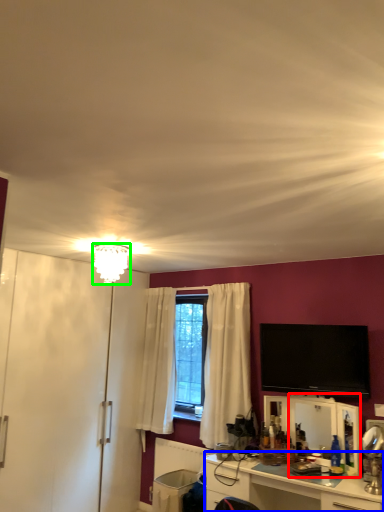
Question: Considering the real-world distances, which object is farthest from mirror (highlighted by a red box)? cabinetry (highlighted by a blue box) or lamp (highlighted by a green box)?

Choices:
 (A) cabinetry
 (B) lamp

Answer: (B)